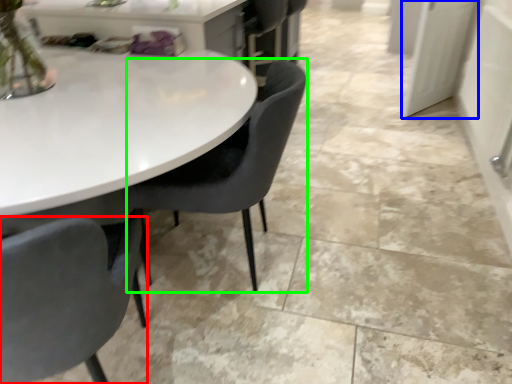
Question: Estimate the real-world distances between objects in this image. Which object is farther from chair (highlighted by a red box), glass door (highlighted by a blue box) or chair (highlighted by a green box)?

Choices:
 (A) glass door
 (B) chair

Answer: (A)